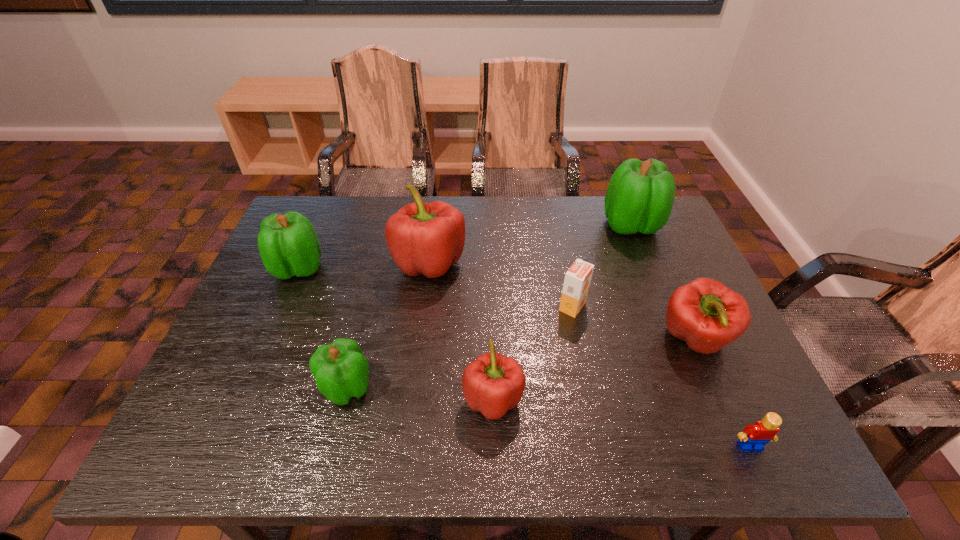
At what (x,y) coordinates should I click in order to perform the action: click on pink bell pepper that is the nearest to the Lego. Please return your answer as a coordinate pair (x, y). Looking at the image, I should click on (707, 315).

Locate which pink bell pepper is the closest to the rightmost pink bell pepper. Please provide its 2D coordinates. Your answer should be formatted as a tuple, i.e. [(x, y)], where the tuple contains the x and y coordinates of a point satisfying the conditions above.

[(492, 384)]